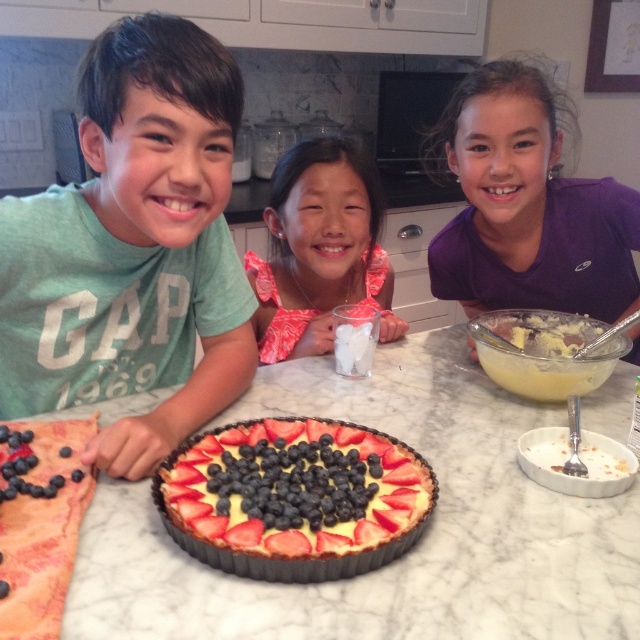
Does point (205, 109) come farther from viewer compared to point (356, 536)?

That is True.

Who is shorter, matte green shirt at left or smooth cream tart at center?

smooth cream tart at center

Which is behind, point (120, 156) or point (228, 442)?

Point (228, 442)

At what (x,y) coordinates should I click in order to perform the action: click on matte green shirt at left. Please return your answer as a coordinate pair (x, y). This screenshot has height=640, width=640. Looking at the image, I should click on (132, 250).

Identify the location of white marble table at center. This screenshot has width=640, height=640. (410, 556).

Can you confirm if white marble table at center is taller than pink floral dress at center?

No.

Does point (108, 492) come behind point (266, 307)?

That is False.

I want to click on white marble table at center, so click(410, 556).

Can you confirm if white marble table at center is shorter than smooth cream tart at center?

No, white marble table at center is not shorter than smooth cream tart at center.

Locate an element on the screen. white marble table at center is located at coordinates (410, 556).